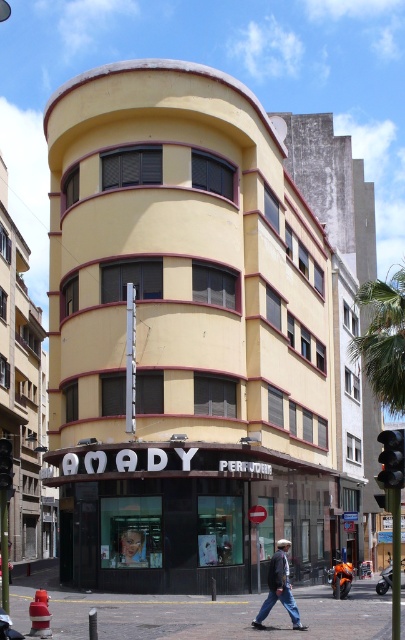
You are standing at the entrance of the AMADY building and see a green leafy palm tree at upper right and a smooth skin face at center. Which object is farther away from you?

The green leafy palm tree at upper right is farther away from you than the smooth skin face at center because it is 15.86 meters away.

You are a photographer standing in front of the building. You want to take a photo that includes both the smooth skin face at center and the black plastic traffic light at center. Which object should you zoom in on to ensure both fit in the frame?

The smooth skin face at center is narrower than the black plastic traffic light at center, so you should zoom in on the black plastic traffic light at center to ensure both fit in the frame.